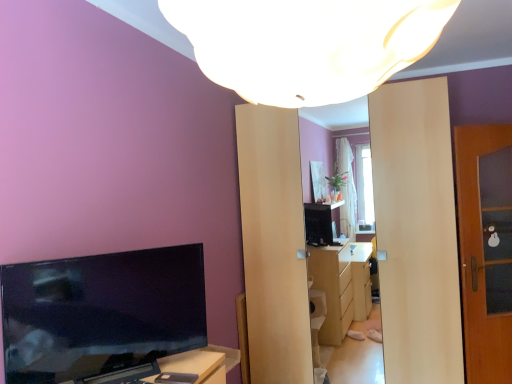
Question: Looking at their shapes, would you say wooden door at right is wider or thinner than white matte lampshade at upper center?

Choices:
 (A) thin
 (B) wide

Answer: (A)

Question: From the image's perspective, is wooden door at right above or below white matte lampshade at upper center?

Choices:
 (A) above
 (B) below

Answer: (B)

Question: Considering the real-world distances, which object is farthest from the black glossy tv at left?

Choices:
 (A) white matte lampshade at upper center
 (B) black matte mobile phone at lower center
 (C) wooden door at right

Answer: (C)

Question: Considering the real-world distances, which object is farthest from the white matte lampshade at upper center?

Choices:
 (A) black matte mobile phone at lower center
 (B) black glossy tv at left
 (C) wooden door at right

Answer: (C)